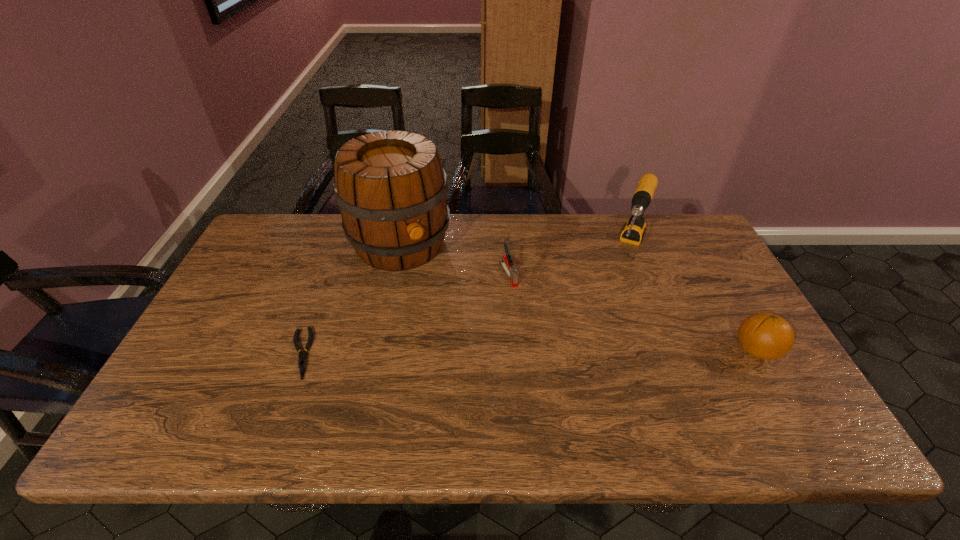
I want to click on pliers, so click(x=302, y=362).

Find the location of a particular element. The height and width of the screenshot is (540, 960). orange is located at coordinates (767, 336).

Find the location of `the third object from left to right`. the third object from left to right is located at coordinates (506, 262).

Locate an element on the screen. The width and height of the screenshot is (960, 540). drill is located at coordinates (634, 229).

Find the location of a particular element. the fourth object from left to right is located at coordinates (634, 229).

Identify the location of the tallest object. Image resolution: width=960 pixels, height=540 pixels. (391, 189).

At what (x,y) coordinates should I click in order to perform the action: click on free region located on the left of the pliers. Please return your answer as a coordinate pair (x, y). Image resolution: width=960 pixels, height=540 pixels. Looking at the image, I should click on (237, 353).

The height and width of the screenshot is (540, 960). Find the location of `free space located on the front of the rightmost object`. free space located on the front of the rightmost object is located at coordinates (779, 390).

Where is `vacant position located 0.320m on the handle side of the third object from left to right`? This screenshot has height=540, width=960. vacant position located 0.320m on the handle side of the third object from left to right is located at coordinates (563, 374).

Image resolution: width=960 pixels, height=540 pixels. Identify the location of free space located on the handle side of the third object from left to right. (557, 364).